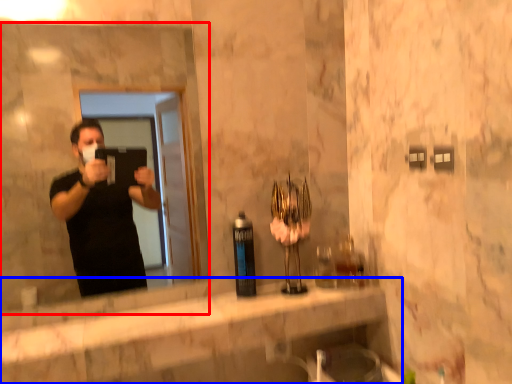
Question: Which object is closer to the camera taking this photo, mirror (highlighted by a red box) or counter top (highlighted by a blue box)?

Choices:
 (A) mirror
 (B) counter top

Answer: (B)